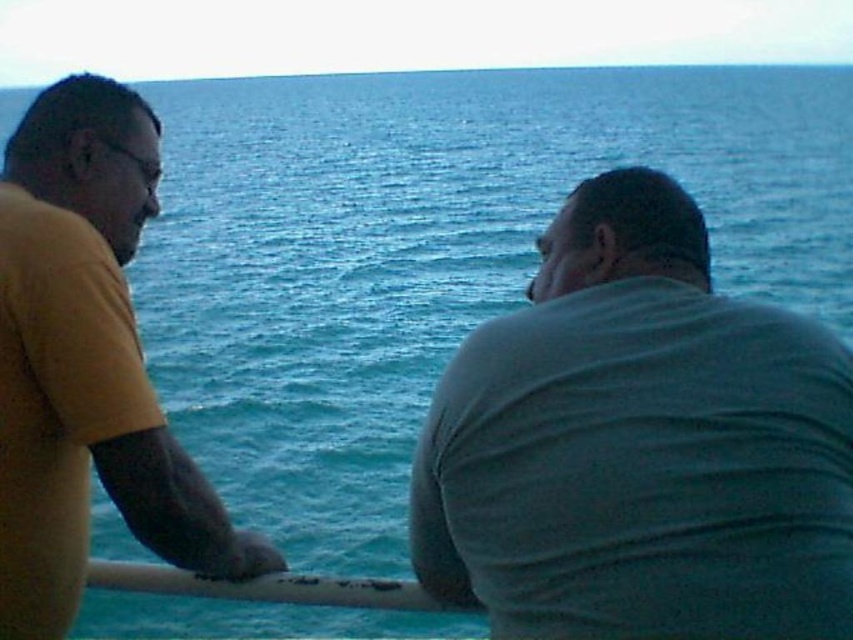
You are standing at point point at (x=635, y=426) and want to take a photo of the two people in the scene. The camera you are using has a focal length of 50mm and a sensor size of 24mm x 36mm. What is the minimum distance you need to be from the camera to ensure both people are fully in frame?

The point at (x=635, y=426) is 2.13 meters away from the camera. To ensure both people are fully in frame, you need to be at least 2.13 meters away from the camera.

You are observing two points in the image of the two people near the ocean. Which point, point (x=50, y=312) or point (x=457, y=609), is nearer to you?

Point (x=50, y=312) is closer to the viewer than point (x=457, y=609).